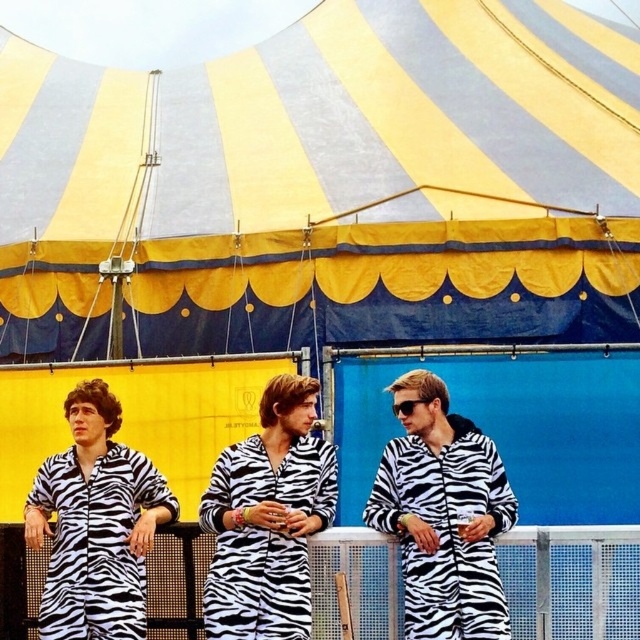
Question: Is zebra print onesie at center further to the viewer compared to zebra-patterned onesie at left?

Choices:
 (A) yes
 (B) no

Answer: (A)

Question: Which object appears closest to the camera in this image?

Choices:
 (A) zebra-patterned onesie at left
 (B) zebra print onesie at center
 (C) yellow/blue striped tent at upper center

Answer: (A)

Question: Is the position of yellow/blue striped tent at upper center less distant than that of zebra print onesie at center?

Choices:
 (A) no
 (B) yes

Answer: (A)

Question: Which object is farther from the camera taking this photo?

Choices:
 (A) zebra-patterned onesie at center
 (B) yellow/blue striped tent at upper center
 (C) zebra-patterned onesie at left
 (D) zebra print onesie at center

Answer: (B)

Question: Which object is farther from the camera taking this photo?

Choices:
 (A) yellow/blue striped tent at upper center
 (B) zebra-patterned onesie at center

Answer: (A)

Question: Is zebra print onesie at center wider than zebra-patterned onesie at left?

Choices:
 (A) no
 (B) yes

Answer: (B)